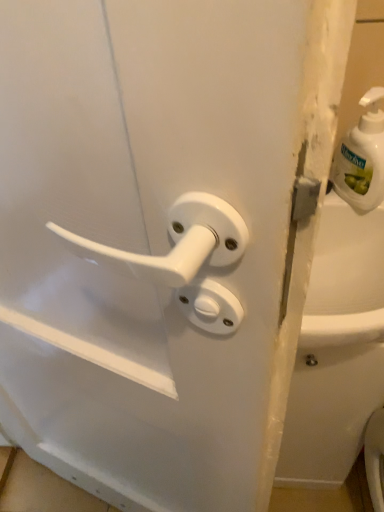
Question: Does point (379, 356) appear closer or farther from the camera than point (339, 159)?

Choices:
 (A) closer
 (B) farther

Answer: (B)

Question: Is white glossy bathtub at right in front of or behind white plastic soap dispenser at upper right in the image?

Choices:
 (A) behind
 (B) front

Answer: (A)

Question: Considering the positions of white glossy bathtub at right and white plastic soap dispenser at upper right in the image, is white glossy bathtub at right wider or thinner than white plastic soap dispenser at upper right?

Choices:
 (A) thin
 (B) wide

Answer: (B)

Question: Looking at their shapes, would you say white plastic soap dispenser at upper right is wider or thinner than white glossy bathtub at right?

Choices:
 (A) wide
 (B) thin

Answer: (B)

Question: Is white plastic soap dispenser at upper right taller or shorter than white glossy bathtub at right?

Choices:
 (A) short
 (B) tall

Answer: (A)

Question: Is white plastic soap dispenser at upper right inside or outside of white glossy bathtub at right?

Choices:
 (A) inside
 (B) outside

Answer: (B)

Question: Looking at the image, does white plastic soap dispenser at upper right seem bigger or smaller compared to white glossy bathtub at right?

Choices:
 (A) small
 (B) big

Answer: (A)